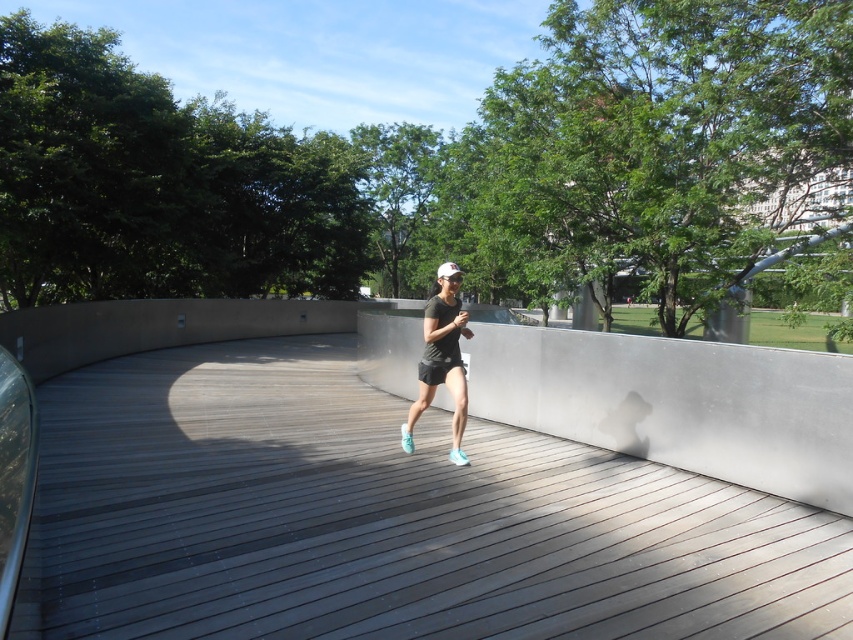
Is point (421, 371) behind point (457, 449)?

No, (421, 371) is closer to viewer.

Between point (433, 381) and point (463, 452), which one is positioned behind?

Positioned behind is point (463, 452).

This screenshot has height=640, width=853. Find the location of `black fabric shorts at center`. black fabric shorts at center is located at coordinates coord(436,369).

Is matte black shorts at center shorter than light blue fabric running shoe at center?

Yes, matte black shorts at center is shorter than light blue fabric running shoe at center.

Does matte black shorts at center come in front of light blue fabric running shoe at center?

Yes, matte black shorts at center is in front of light blue fabric running shoe at center.

Between point (426, 323) and point (412, 449), which one is positioned in front?

Point (426, 323) is more forward.

Where is `matte black shorts at center`? matte black shorts at center is located at coordinates (444, 349).

Does wooden at center appear on the right side of light blue fabric running shoe at center?

In fact, wooden at center is to the left of light blue fabric running shoe at center.

Identify the location of wooden at center. The image size is (853, 640). (384, 518).

I want to click on wooden at center, so click(x=384, y=518).